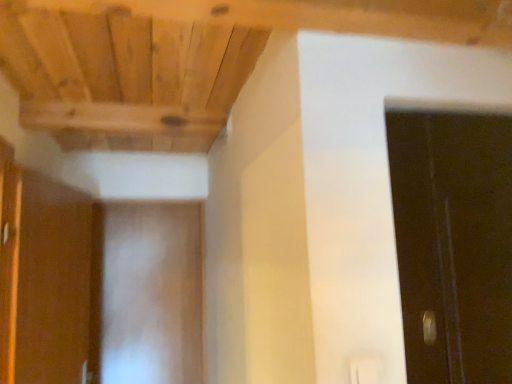
Question: Does brown wood cabinet at left appear on the left side of white matte door at center?

Choices:
 (A) yes
 (B) no

Answer: (A)

Question: Does brown wood cabinet at left have a larger size compared to white matte door at center?

Choices:
 (A) yes
 (B) no

Answer: (A)

Question: Can you confirm if brown wood cabinet at left is thinner than white matte door at center?

Choices:
 (A) yes
 (B) no

Answer: (B)

Question: From the image's perspective, does brown wood cabinet at left appear higher than white matte door at center?

Choices:
 (A) yes
 (B) no

Answer: (A)

Question: Is brown wood cabinet at left shorter than white matte door at center?

Choices:
 (A) yes
 (B) no

Answer: (A)

Question: Are brown wood cabinet at left and white matte door at center beside each other?

Choices:
 (A) no
 (B) yes

Answer: (A)

Question: Is white matte door at center looking in the opposite direction of brown wood cabinet at left?

Choices:
 (A) no
 (B) yes

Answer: (A)

Question: From a real-world perspective, is white matte door at center physically above brown wood cabinet at left?

Choices:
 (A) no
 (B) yes

Answer: (A)

Question: Is the depth of white matte door at center less than that of brown wood cabinet at left?

Choices:
 (A) yes
 (B) no

Answer: (B)

Question: Can you confirm if white matte door at center is bigger than brown wood cabinet at left?

Choices:
 (A) no
 (B) yes

Answer: (A)

Question: Is white matte door at center facing towards brown wood cabinet at left?

Choices:
 (A) yes
 (B) no

Answer: (A)

Question: Is white matte door at center behind brown wood cabinet at left?

Choices:
 (A) no
 (B) yes

Answer: (B)

Question: Relative to brown wood cabinet at left, is white matte door at center in front or behind?

Choices:
 (A) behind
 (B) front

Answer: (A)